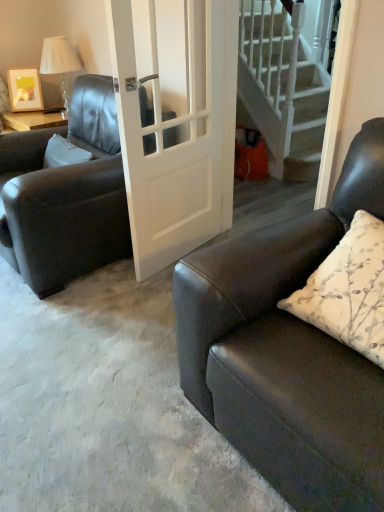
Question: Is white fabric lampshade at upper left bigger or smaller than white glossy door at center?

Choices:
 (A) big
 (B) small

Answer: (B)

Question: In terms of height, does white fabric lampshade at upper left look taller or shorter compared to white glossy door at center?

Choices:
 (A) short
 (B) tall

Answer: (A)

Question: Considering the real-world distances, which object is closest to the white glossy door at center?

Choices:
 (A) matte black leather chair at left
 (B) white floral pillow at right
 (C) matte black couch at right
 (D) white wooden stairs at upper right
 (E) white fabric lampshade at upper left

Answer: (A)

Question: Estimate the real-world distances between objects in this image. Which object is closer to the matte black couch at right?

Choices:
 (A) white wooden stairs at upper right
 (B) matte black leather chair at left
 (C) wooden picture frame at upper left
 (D) white floral pillow at right
 (E) white glossy door at center

Answer: (D)